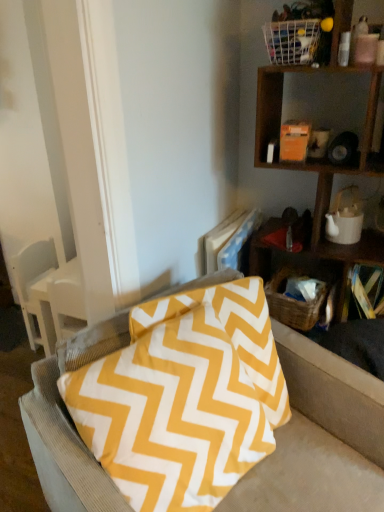
Question: Which is correct: woven brown basket at lower right, the 1th basket positioned from the back, is inside white ceramic teapot at upper right, or outside of it?

Choices:
 (A) outside
 (B) inside

Answer: (A)

Question: Is woven brown basket at lower right, placed as the second basket when sorted from front to back, to the left or to the right of white ceramic teapot at upper right in the image?

Choices:
 (A) left
 (B) right

Answer: (A)

Question: Which of these objects is positioned closest to the white wire basket at upper right, the 1th basket positioned from the top?

Choices:
 (A) yellow fabric pillow at center
 (B) yellow zigzag-patterned pillow at right
 (C) white ceramic teapot at upper right
 (D) wooden shelf at upper right
 (E) woven brown basket at lower right, placed as the second basket when sorted from front to back

Answer: (D)

Question: Based on their relative distances, which object is nearer to the yellow zigzag-patterned pillow at right?

Choices:
 (A) woven brown basket at lower right, placed as the second basket when sorted from front to back
 (B) white wire basket at upper right, which is the second basket from back to front
 (C) wooden shelf at upper right
 (D) white ceramic teapot at upper right
 (E) yellow fabric pillow at center

Answer: (A)